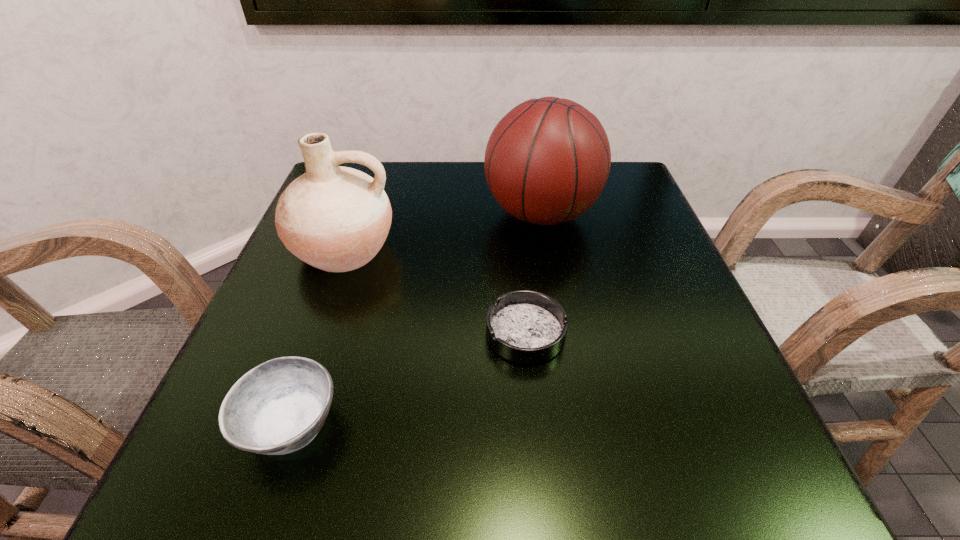
In the image, there is a desktop. Find the location of `vacant space at the near left corner`. vacant space at the near left corner is located at coordinates (182, 460).

Locate an element on the screen. free space between the pottery and the taller ashtray is located at coordinates (317, 336).

I want to click on empty space between the pottery and the shorter ashtray, so click(x=435, y=291).

Identify the location of free space between the left ashtray and the pottery. (317, 336).

Locate an element on the screen. free spot between the basketball and the pottery is located at coordinates (443, 232).

The width and height of the screenshot is (960, 540). Identify the location of empty location between the nearest object and the pottery. (317, 336).

You are a GUI agent. You are given a task and a screenshot of the screen. Output one action in this format:
    pyautogui.click(x=<x>, y=<y>)
    Task: Click on the free spot between the right ashtray and the pottery
    
    Given the screenshot: What is the action you would take?
    pyautogui.click(x=435, y=291)

Identify the location of empty location between the basketball and the shorter ashtray. (533, 273).

The height and width of the screenshot is (540, 960). I want to click on vacant area between the nearer ashtray and the third farthest object, so point(408,379).

I want to click on free spot between the basketball and the farther ashtray, so click(533, 273).